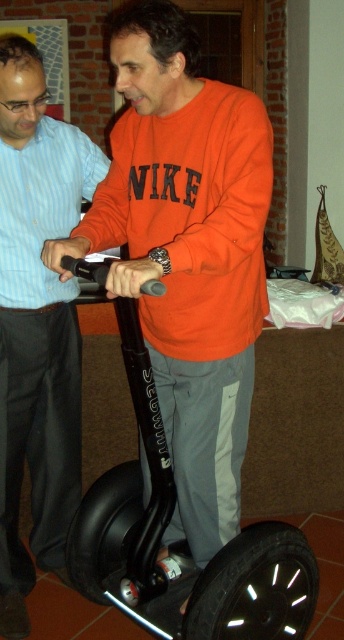
Question: Does matte black scooter at center appear on the left side of black rubber scooter at center?

Choices:
 (A) yes
 (B) no

Answer: (A)

Question: Does matte black scooter at center have a larger size compared to black rubber scooter at center?

Choices:
 (A) yes
 (B) no

Answer: (B)

Question: Is orange matte sweatshirt at center bigger than matte black scooter at center?

Choices:
 (A) no
 (B) yes

Answer: (B)

Question: Which point is closer to the camera taking this photo?

Choices:
 (A) (124, 280)
 (B) (221, 577)
 (C) (11, 264)

Answer: (A)

Question: Considering the real-world distances, which object is farthest from the matte black scooter at center?

Choices:
 (A) black rubber scooter at center
 (B) orange matte sweatshirt at center

Answer: (A)

Question: Among these points, which one is nearest to the camera?

Choices:
 (A) (112, 488)
 (B) (14, 136)
 (C) (175, 396)

Answer: (C)